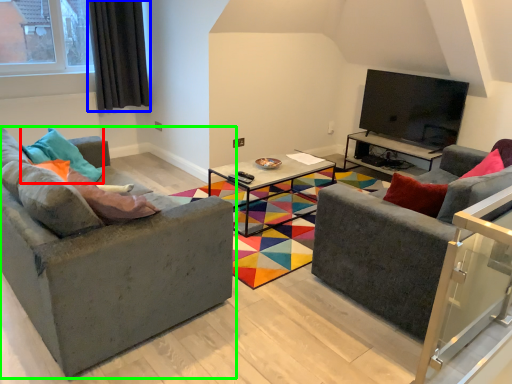
Question: Based on their relative distances, which object is farther from pillow (highlighted by a red box)? Choose from curtain (highlighted by a blue box) and studio couch (highlighted by a green box).

Choices:
 (A) curtain
 (B) studio couch

Answer: (A)